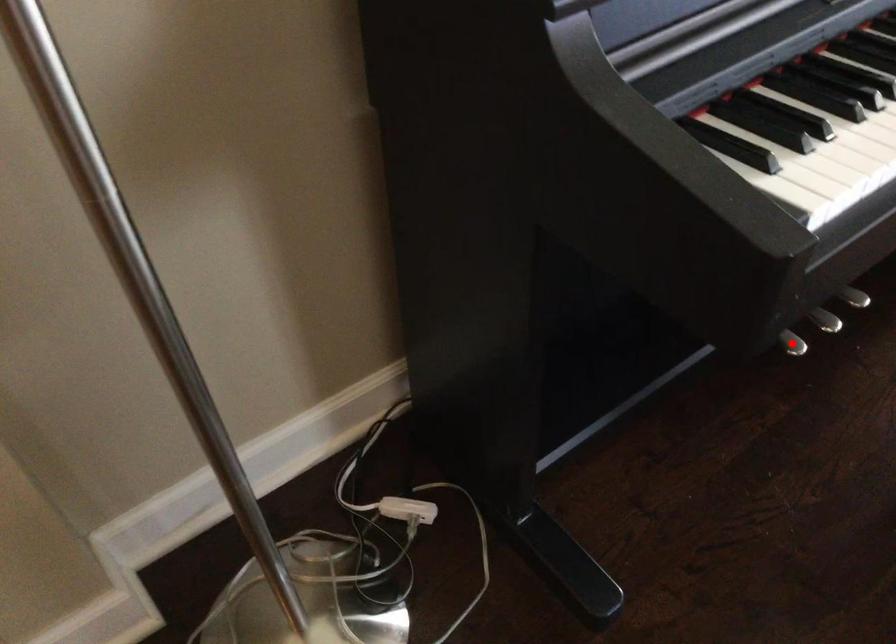
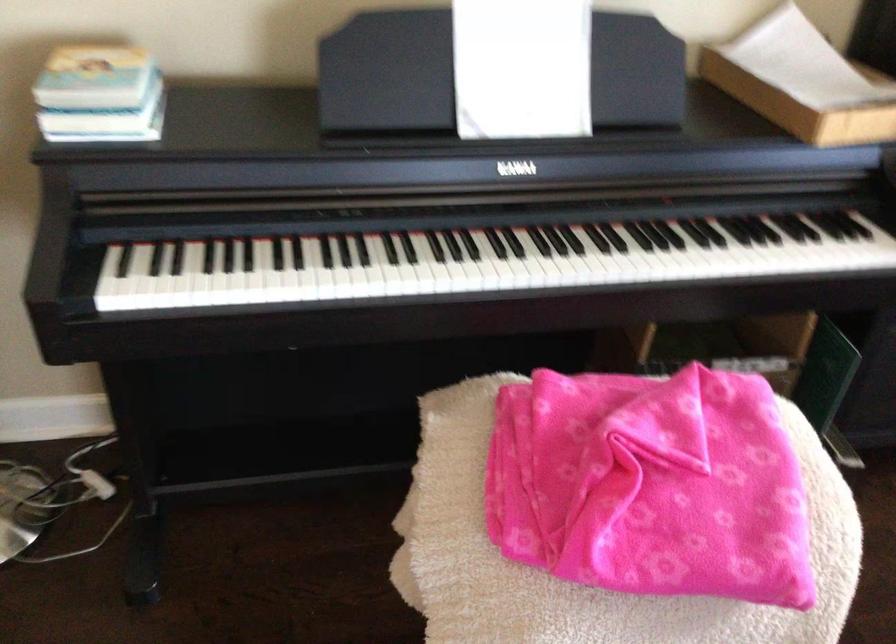
Question: I am providing you with two images of the same scene from different viewpoints. A red point is marked on the first image. Can you still see the location of the red point in image 2?

Choices:
 (A) Yes
 (B) No

Answer: (B)